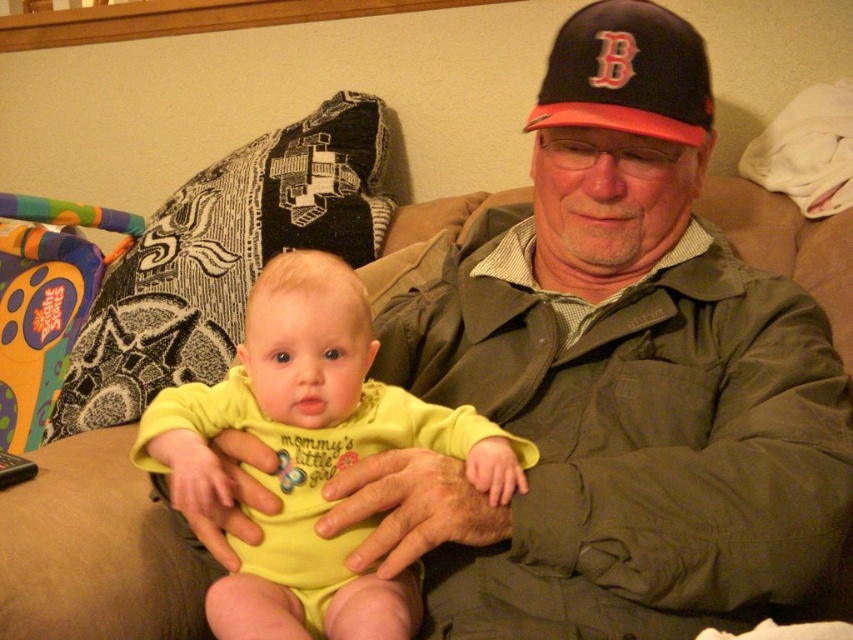
Question: Does yellow soft fabric baby at center have a lesser width compared to black fabric baseball cap at upper center?

Choices:
 (A) yes
 (B) no

Answer: (B)

Question: Which object is farther from the camera taking this photo?

Choices:
 (A) black fabric baseball cap at upper center
 (B) yellow soft fabric baby at center

Answer: (A)

Question: Which point appears farthest from the camera in this image?

Choices:
 (A) (343, 541)
 (B) (621, 64)

Answer: (B)

Question: Does yellow soft fabric baby at center have a greater width compared to black fabric baseball cap at upper center?

Choices:
 (A) yes
 (B) no

Answer: (A)

Question: Is yellow soft fabric baby at center to the left of black fabric baseball cap at upper center from the viewer's perspective?

Choices:
 (A) no
 (B) yes

Answer: (B)